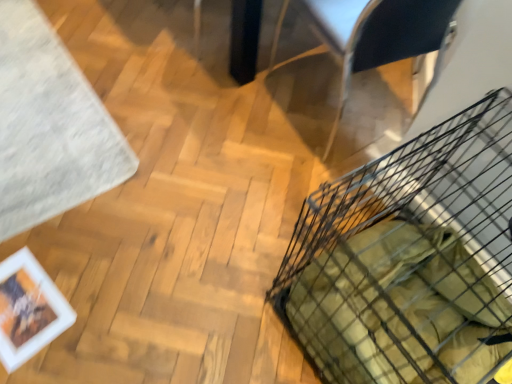
This screenshot has width=512, height=384. I want to click on free space that is in between metallic silver armchair at upper right and white soft rug at upper left, so click(x=176, y=94).